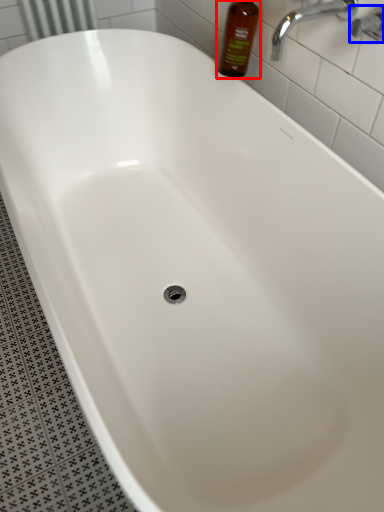
Question: Which object is further to the camera taking this photo, bottle (highlighted by a red box) or plumbing fixture (highlighted by a blue box)?

Choices:
 (A) bottle
 (B) plumbing fixture

Answer: (A)